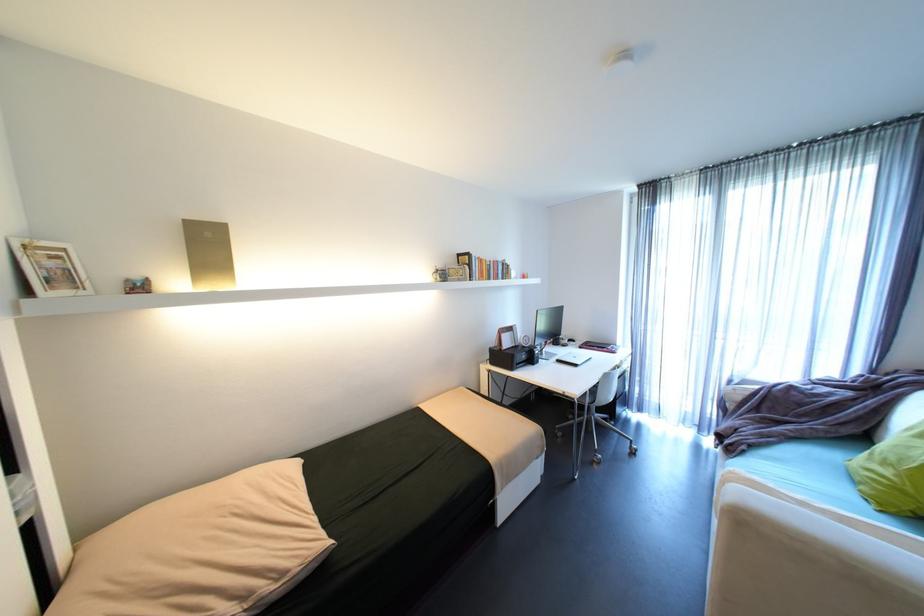
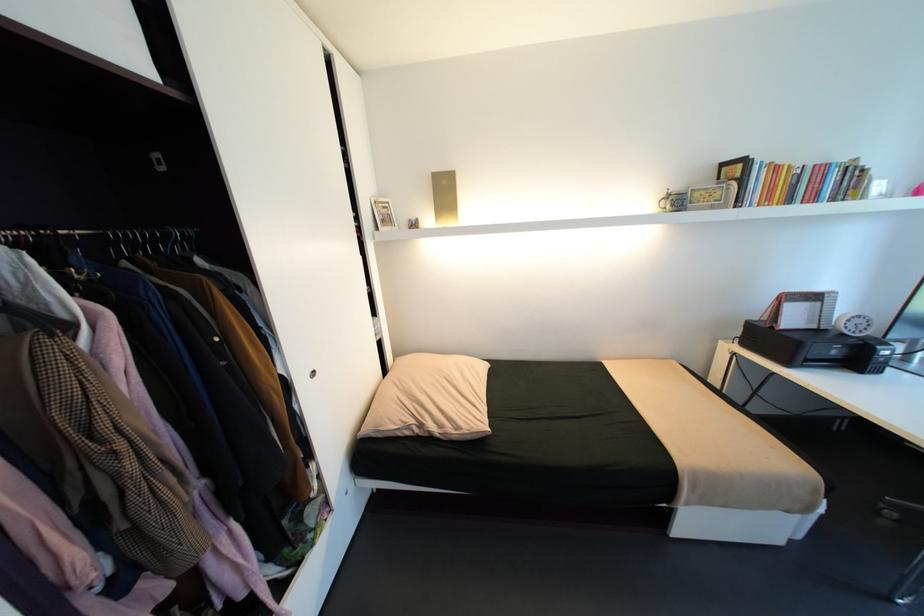
Find the pixel in the second image that matches (x=530, y=347) in the first image.

(850, 334)